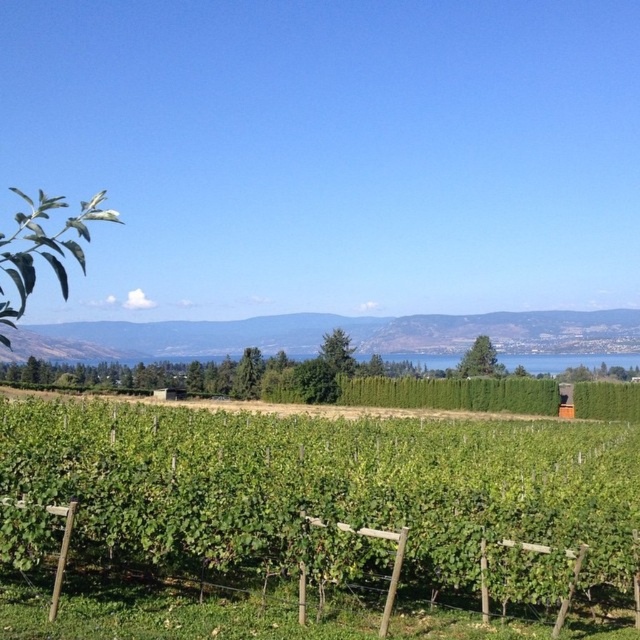
You are a gardener planning to install a new irrigation system for the green leafy vines at center and the green leafy hillside at center. Considering their heights, which area might require taller sprinklers?

The green leafy hillside at center is taller than the green leafy vines at center, so the hillside area might require taller sprinklers to ensure adequate coverage.

You are a landscape architect designing a pathway through the vineyard. You need to determine if the green leafy vines at center can be trimmed to allow a 2m wide path between them and the green leafy hedge at center. Based on their current widths, is this possible?

The green leafy vines at center might be wider than the green leafy hedge at center, so it is uncertain whether trimming them would allow a 2m wide path. Further measurement or clarification is needed to confirm.

Looking at this image, you are a landscape architect designing a new vineyard. You have two areas to plant crops in the center of the scene. The first area is for the green leafy vines at center, and the second area is for the green leafy hillside at center. Which area requires a narrower space for planting?

The green leafy vines at center require a narrower space for planting since their width is less than that of the green leafy hillside at center.